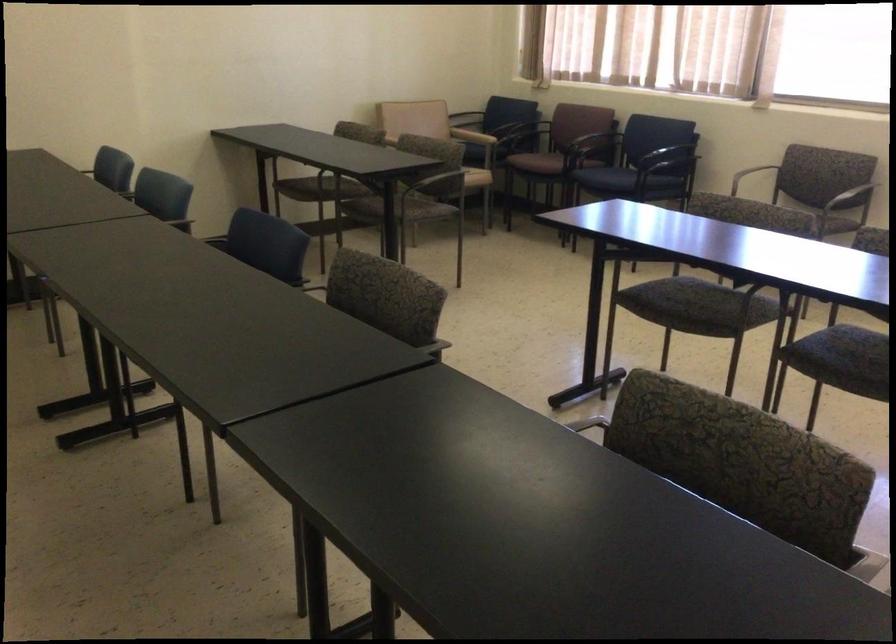
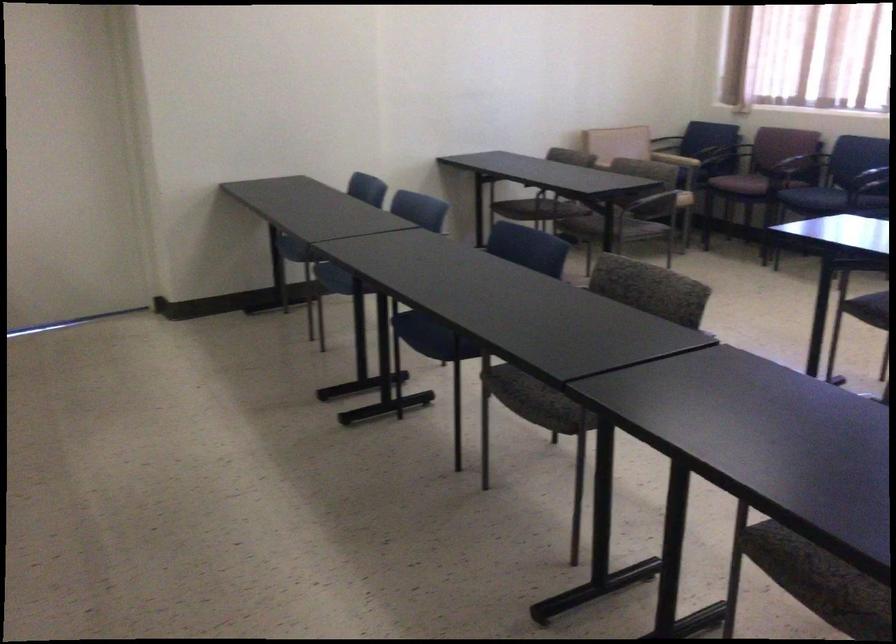
Find the pixel in the second image that matches point 596,136 in the first image.

(800, 160)